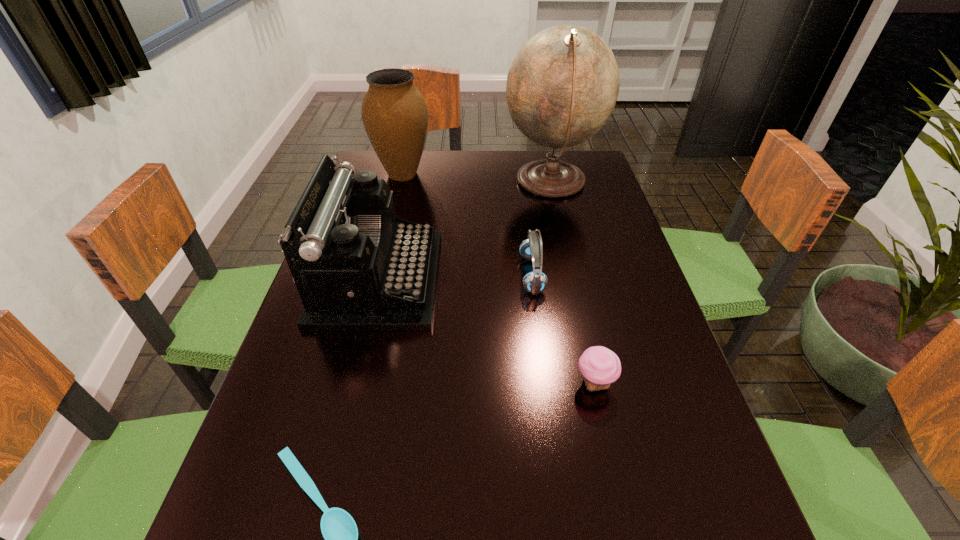
This screenshot has width=960, height=540. I want to click on the tallest object, so click(x=562, y=86).

Where is `urn`? urn is located at coordinates (394, 113).

Image resolution: width=960 pixels, height=540 pixels. In order to click on typewriter in this screenshot , I will do `click(358, 267)`.

Where is `headset`? headset is located at coordinates (535, 281).

At what (x,y) coordinates should I click in order to perform the action: click on the fifth farthest object. Please return your answer as a coordinate pair (x, y). The height and width of the screenshot is (540, 960). Looking at the image, I should click on (600, 367).

The height and width of the screenshot is (540, 960). Find the location of `the fifth tallest object`. the fifth tallest object is located at coordinates (600, 367).

Find the location of a particular element. free spot located 0.280m on the front-facing side of the tallest object is located at coordinates (410, 183).

At what (x,y) coordinates should I click in order to perform the action: click on vacant space situated 0.170m on the front-facing side of the tallest object. Please return your answer as a coordinate pair (x, y). Looking at the image, I should click on (446, 183).

Locate an element on the screen. The height and width of the screenshot is (540, 960). free region located on the front-facing side of the tallest object is located at coordinates (440, 183).

At what (x,y) coordinates should I click in order to perform the action: click on vacant space located on the front of the urn. Please return your answer as a coordinate pair (x, y). The width and height of the screenshot is (960, 540). Looking at the image, I should click on (382, 256).